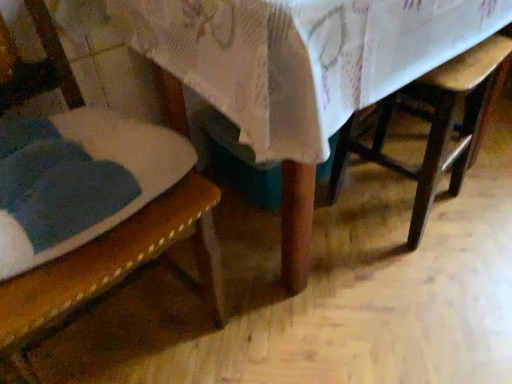
Where is `vacant space in front of wooden chair at lower right`? This screenshot has width=512, height=384. vacant space in front of wooden chair at lower right is located at coordinates (417, 274).